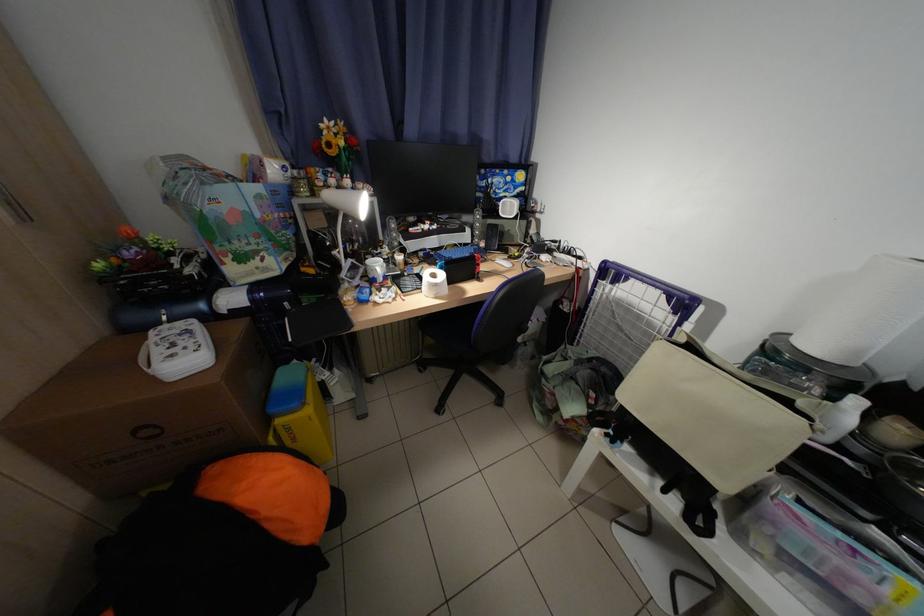
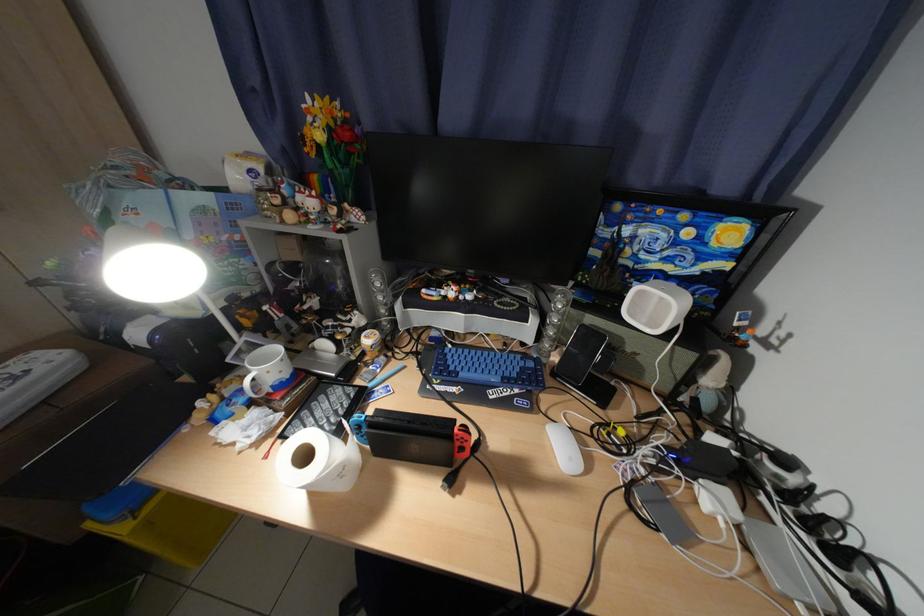
Find the pixel in the second image that matches pixel 411 259 in the first image.

(381, 341)